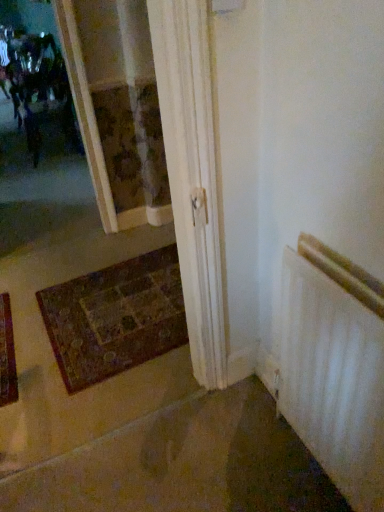
Question: From a real-world perspective, is multicolored woven mat at lower left above or below white matte radiator at lower right?

Choices:
 (A) below
 (B) above

Answer: (A)

Question: In the image, is multicolored woven mat at lower left positioned in front of or behind white matte radiator at lower right?

Choices:
 (A) front
 (B) behind

Answer: (B)

Question: Is multicolored woven mat at lower left to the left or to the right of white matte radiator at lower right in the image?

Choices:
 (A) left
 (B) right

Answer: (A)

Question: Relative to multicolored woven mat at lower left, is white matte radiator at lower right in front or behind?

Choices:
 (A) behind
 (B) front

Answer: (B)

Question: Is white matte radiator at lower right bigger or smaller than multicolored woven mat at lower left?

Choices:
 (A) big
 (B) small

Answer: (A)

Question: From a real-world perspective, is white matte radiator at lower right positioned above or below multicolored woven mat at lower left?

Choices:
 (A) above
 (B) below

Answer: (A)

Question: Does point (306, 373) appear closer or farther from the camera than point (147, 288)?

Choices:
 (A) closer
 (B) farther

Answer: (A)